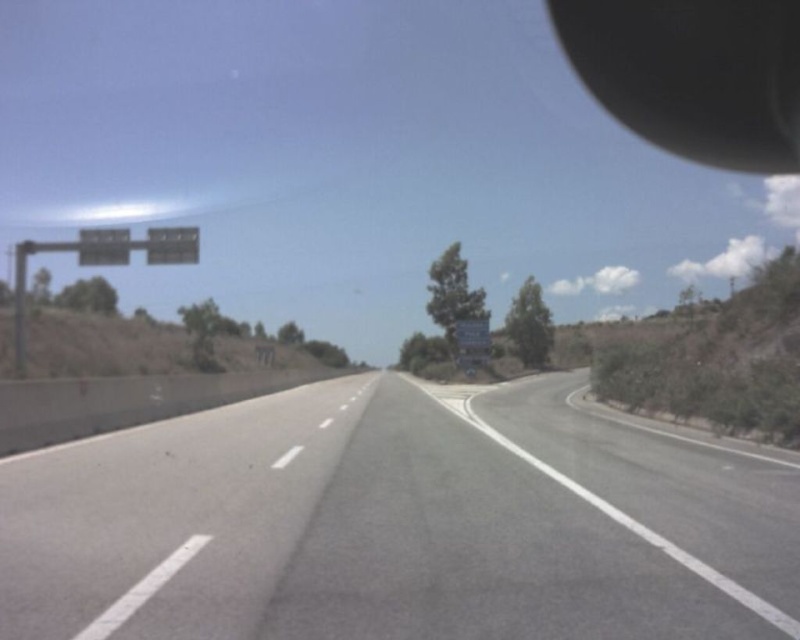
Question: Is black matte view mirror at upper right bigger than metallic gray sign at upper center?

Choices:
 (A) yes
 (B) no

Answer: (A)

Question: Which of the following is the farthest from the observer?

Choices:
 (A) (776, 173)
 (B) (96, 253)

Answer: (A)

Question: Where is black matte view mirror at upper right located in relation to white plastic sign at upper left in the image?

Choices:
 (A) above
 (B) below

Answer: (A)

Question: Which point is farther from the camera taking this photo?

Choices:
 (A) (758, 40)
 (B) (160, 260)
 (C) (120, 260)

Answer: (A)

Question: Which of the following is the farthest from the observer?

Choices:
 (A) white plastic sign at upper left
 (B) gray asphalt highway at center
 (C) black matte view mirror at upper right

Answer: (C)

Question: Is black matte view mirror at upper right wider than metallic gray sign at upper center?

Choices:
 (A) no
 (B) yes

Answer: (B)